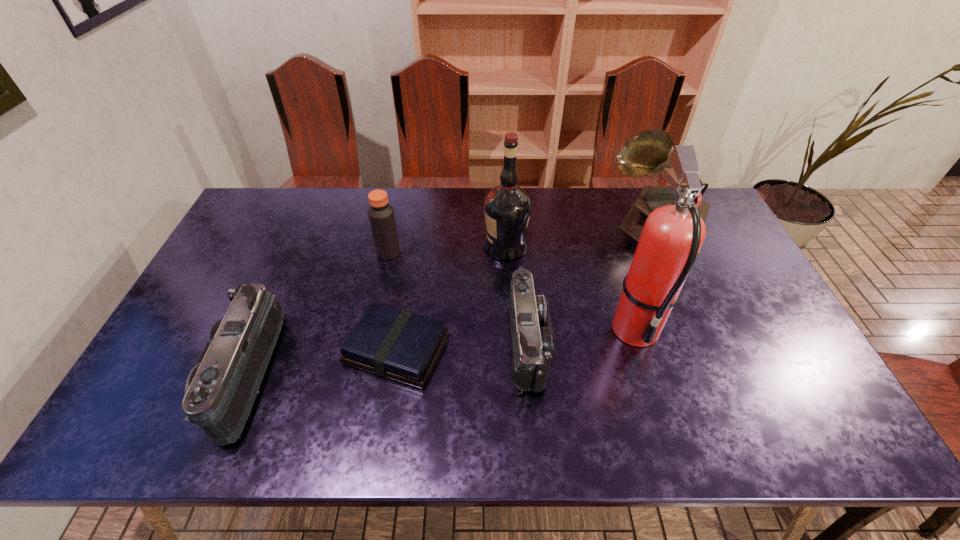
You are a GUI agent. You are given a task and a screenshot of the screen. Output one action in this format:
    pyautogui.click(x=<x>, y=<y>)
    Task: Click on the blank area located on the front-facing side of the taller camcorder
    
    Given the screenshot: What is the action you would take?
    pyautogui.click(x=156, y=375)

Locate an element on the screen. Image resolution: width=960 pixels, height=540 pixels. free region located on the front-facing side of the taller camcorder is located at coordinates (160, 375).

The height and width of the screenshot is (540, 960). I want to click on vacant space positioned on the front-facing side of the shorter camcorder, so tap(570, 345).

Image resolution: width=960 pixels, height=540 pixels. Identify the location of vacant region located on the surface of the sixth shortest object. (413, 246).

Find the location of a particular element. vacant space situated on the surface of the sixth shortest object is located at coordinates (462, 246).

This screenshot has width=960, height=540. In order to click on vacant space located 0.240m on the surface of the sixth shortest object in this screenshot , I will do `click(410, 246)`.

Where is `free region located 0.050m on the horn direction of the phonograph record`? free region located 0.050m on the horn direction of the phonograph record is located at coordinates (592, 224).

At what (x,y) coordinates should I click in order to perform the action: click on free spot located on the horn direction of the phonograph record. Please return your answer as a coordinate pair (x, y). This screenshot has height=540, width=960. Looking at the image, I should click on (522, 224).

Where is `vacant space located 0.110m on the horn direction of the phonograph record`? The height and width of the screenshot is (540, 960). vacant space located 0.110m on the horn direction of the phonograph record is located at coordinates (575, 224).

This screenshot has height=540, width=960. Find the location of `vacant area situated 0.190m on the right of the fourth shortest object`. vacant area situated 0.190m on the right of the fourth shortest object is located at coordinates (460, 253).